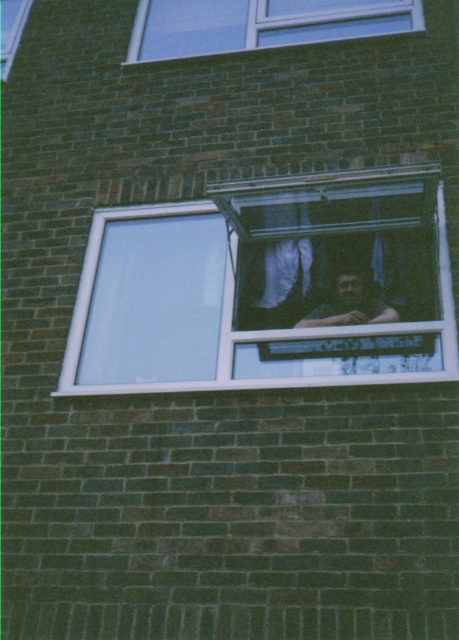
Who is lower down, clear glass window at center or transparent glass window at upper center?

clear glass window at center is below.

Does clear glass window at center have a greater width compared to transparent glass window at upper center?

Correct, the width of clear glass window at center exceeds that of transparent glass window at upper center.

In the scene shown: Who is more distant from viewer, (319,298) or (217,45)?

Positioned behind is point (217,45).

Image resolution: width=459 pixels, height=640 pixels. Find the location of `clear glass window at center`. clear glass window at center is located at coordinates (268, 288).

Does transparent glass window at upper center have a larger size compared to dark brown hair at center?

Correct, transparent glass window at upper center is larger in size than dark brown hair at center.

Who is more distant from viewer, (239, 40) or (320, 321)?

Point (239, 40)

The image size is (459, 640). Find the location of `transparent glass window at upper center`. transparent glass window at upper center is located at coordinates (259, 22).

Is point (186, 310) behind point (347, 300)?

No, (186, 310) is in front of (347, 300).

Based on the photo, can you confirm if clear glass window at center is positioned to the left of dark brown hair at center?

Correct, you'll find clear glass window at center to the left of dark brown hair at center.

Between point (95, 266) and point (363, 272), which one is positioned in front?

Point (95, 266)

I want to click on clear glass window at center, so click(268, 288).